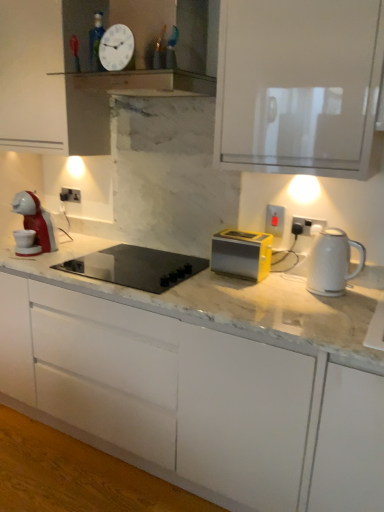
Question: Is the depth of white glossy electric kettle at right less than that of white plastic electric outlet at left, the third electric outlet positioned from the right?

Choices:
 (A) yes
 (B) no

Answer: (A)

Question: Is white glossy electric kettle at right not within white plastic electric outlet at left, the 3th electric outlet in the front-to-back sequence?

Choices:
 (A) yes
 (B) no

Answer: (A)

Question: Is white glossy electric kettle at right oriented away from white plastic electric outlet at left, the third electric outlet from the bottom?

Choices:
 (A) yes
 (B) no

Answer: (B)

Question: From the image's perspective, is white glossy electric kettle at right located above white plastic electric outlet at left, the first electric outlet viewed from the top?

Choices:
 (A) no
 (B) yes

Answer: (A)

Question: Is white glossy electric kettle at right at the left side of white plastic electric outlet at left, the 3th electric outlet in the front-to-back sequence?

Choices:
 (A) no
 (B) yes

Answer: (A)

Question: Can you confirm if white glossy electric kettle at right is smaller than white plastic electric outlet at left, acting as the first electric outlet starting from the left?

Choices:
 (A) no
 (B) yes

Answer: (A)

Question: Can you confirm if black glass cooktop at center is wider than white matte cabinet at center?

Choices:
 (A) no
 (B) yes

Answer: (A)

Question: Would you say black glass cooktop at center contains white matte cabinet at center?

Choices:
 (A) no
 (B) yes

Answer: (A)

Question: Considering the relative sizes of black glass cooktop at center and white matte cabinet at center in the image provided, is black glass cooktop at center smaller than white matte cabinet at center?

Choices:
 (A) yes
 (B) no

Answer: (A)

Question: From the image's perspective, is black glass cooktop at center located above white matte cabinet at center?

Choices:
 (A) no
 (B) yes

Answer: (B)

Question: Is black glass cooktop at center not inside white matte cabinet at center?

Choices:
 (A) yes
 (B) no

Answer: (B)

Question: Is black glass cooktop at center to the right of white matte cabinet at center from the viewer's perspective?

Choices:
 (A) no
 (B) yes

Answer: (A)

Question: Is matte plastic electric outlet at center-right, which is the second electric outlet in left-to-right order, smaller than white glossy electric kettle at right?

Choices:
 (A) no
 (B) yes

Answer: (B)